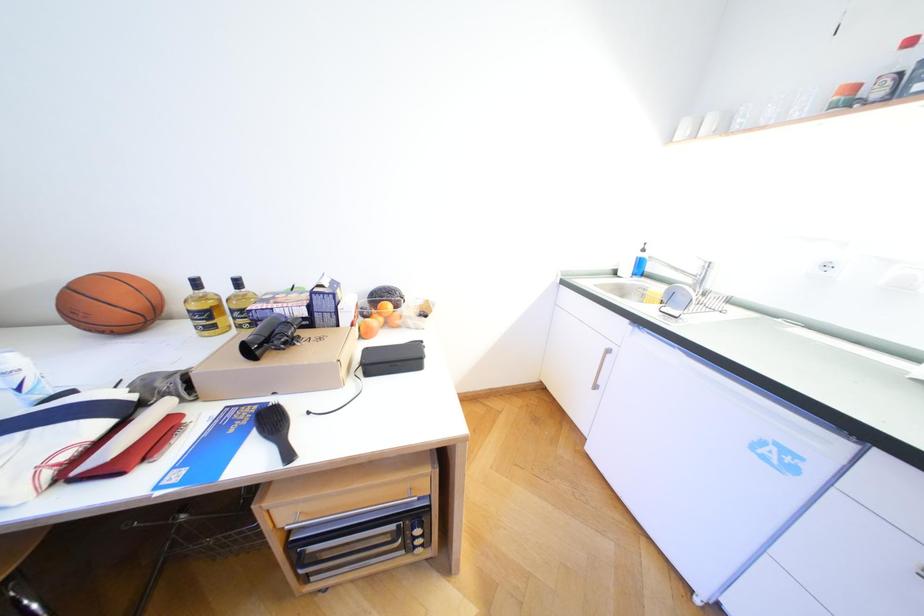
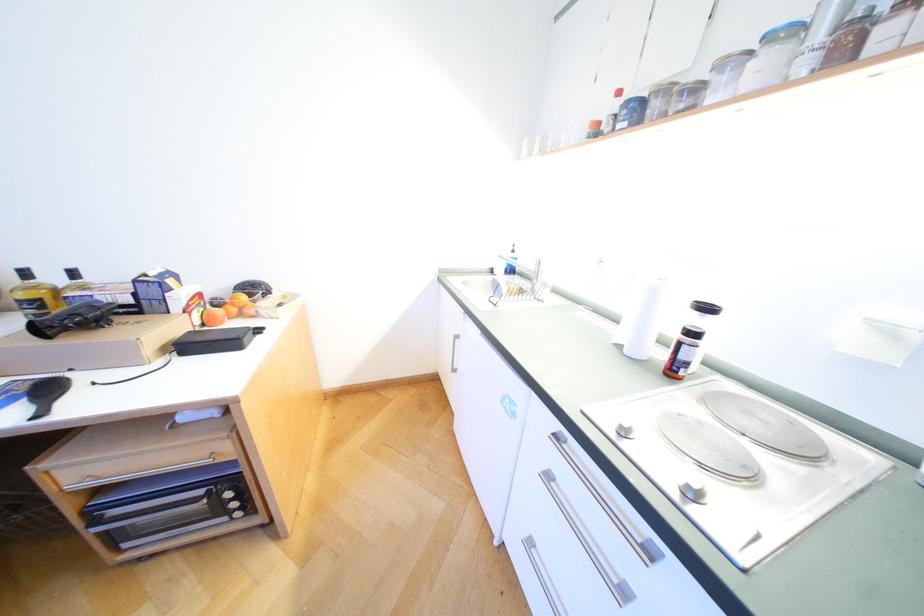
Question: What movement of the cameraman would produce the second image?

Choices:
 (A) Left
 (B) Right
 (C) Forward
 (D) Backward

Answer: (B)